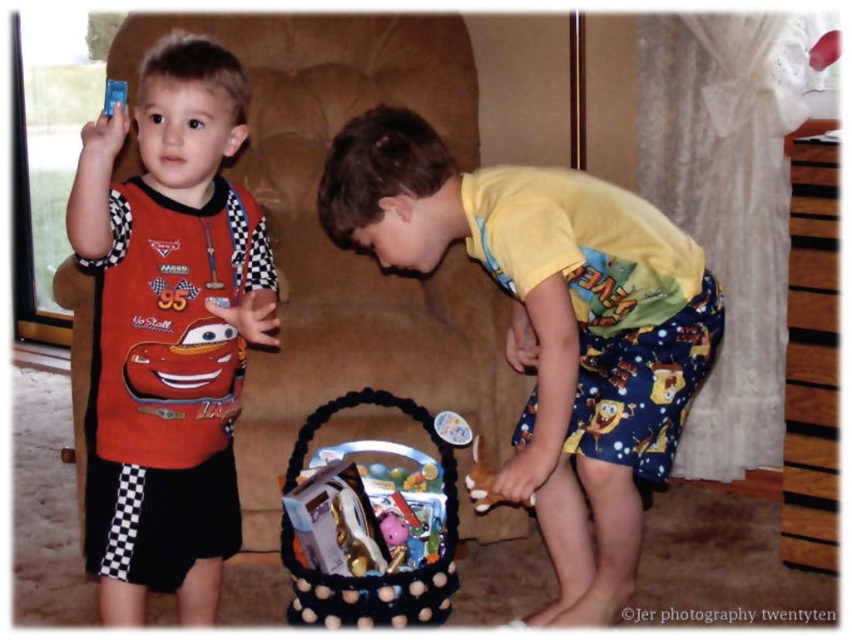
You are a parent trying to organize the living room. You want to place a new decorative pillow on the brown fabric armchair at center so it doesn not fall off. Considering the black woven basket at lower center is nearby, where should you position the pillow to ensure it stays in place?

Place the decorative pillow on the brown fabric armchair at center above the black woven basket at lower center to ensure it stays in place since the armchair is positioned higher than the basket.

You are a photographer trying to capture a candid shot of the children in the scene. The brown fabric armchair at center is located at point coordinates of (337,246). If you want to frame the shot so that the armchair is at the center of your viewfinder, which direction should you move your camera? Please respond with either left, right, up, or down.

→ The point coordinates provided are already at the center of the viewfinder, so you do not need to move the camera. The brown fabric armchair at center is already positioned at the center point of the scene.

You are a parent trying to put away toys. You see the brown fabric armchair at center and the matte plastic toy car at left. Can you place the toy car on the armchair without moving either object?

The brown fabric armchair at center and matte plastic toy car at left are 21.76 inches apart, so the distance between them is sufficient to place the toy car on the armchair without needing to move either object.